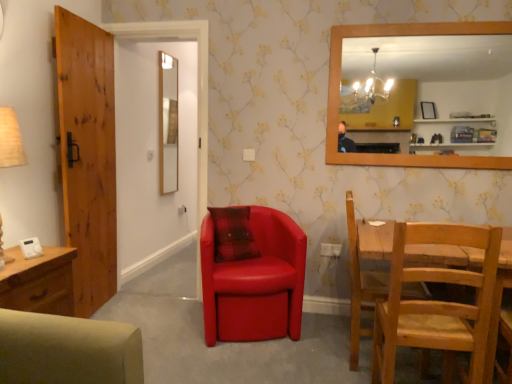
Find the location of `vacant space in front of matte red leather armchair at center, the 2th chair viewed from the right`. vacant space in front of matte red leather armchair at center, the 2th chair viewed from the right is located at coordinates (232, 358).